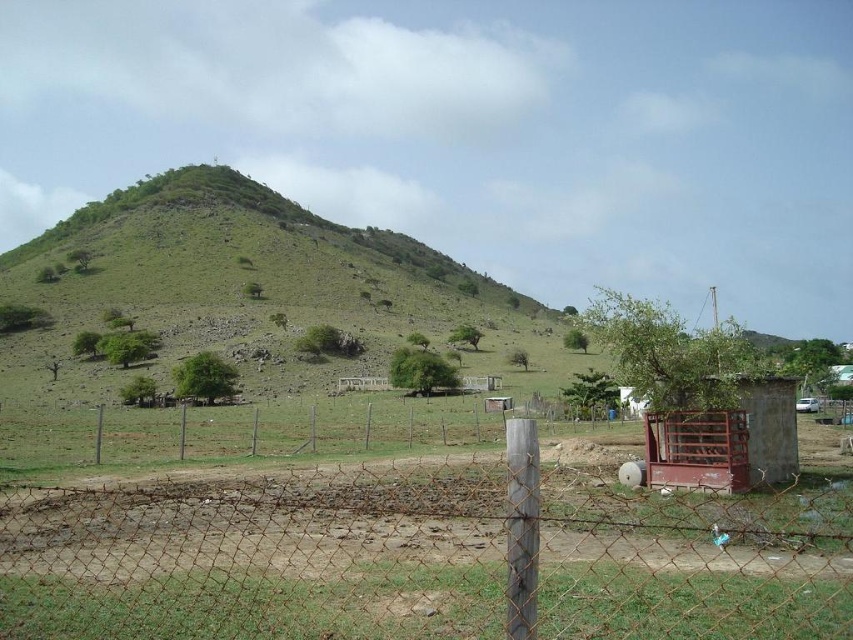
Is point (344, 595) closer to viewer compared to point (154, 356)?

Yes, it is in front of point (154, 356).

Is the position of rusty wire mesh fence at center more distant than that of green grassy hillside at upper center?

No, it is not.

Measure the distance between rusty wire mesh fence at center and camera.

rusty wire mesh fence at center is 32.44 feet away from camera.

This screenshot has height=640, width=853. I want to click on rusty wire mesh fence at center, so click(x=426, y=556).